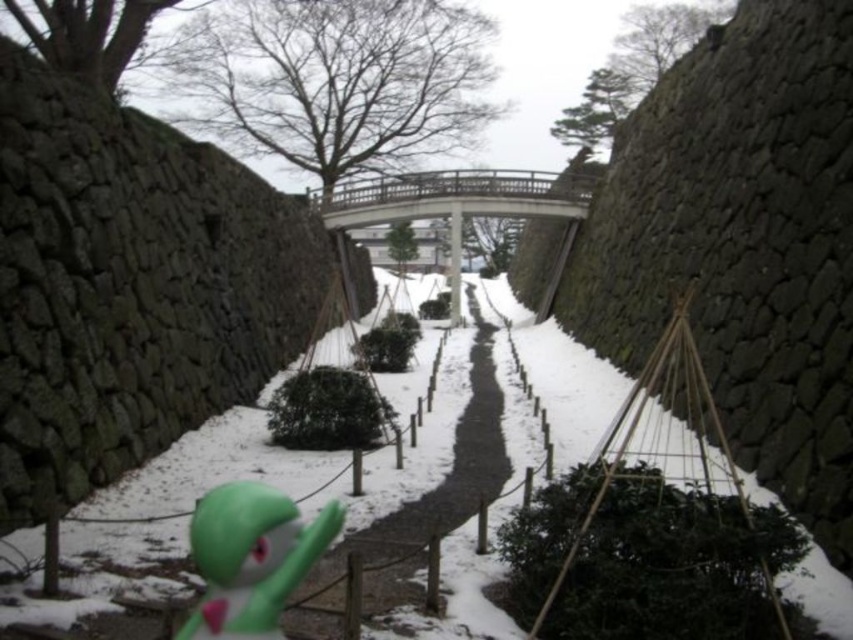
Can you confirm if snowy gravel path at center is positioned to the left of green rubber toy at lower left?

Incorrect, snowy gravel path at center is not on the left side of green rubber toy at lower left.

Which is more to the right, snowy gravel path at center or green rubber toy at lower left?

From the viewer's perspective, snowy gravel path at center appears more on the right side.

Where is `snowy gravel path at center`? This screenshot has height=640, width=853. snowy gravel path at center is located at coordinates (433, 492).